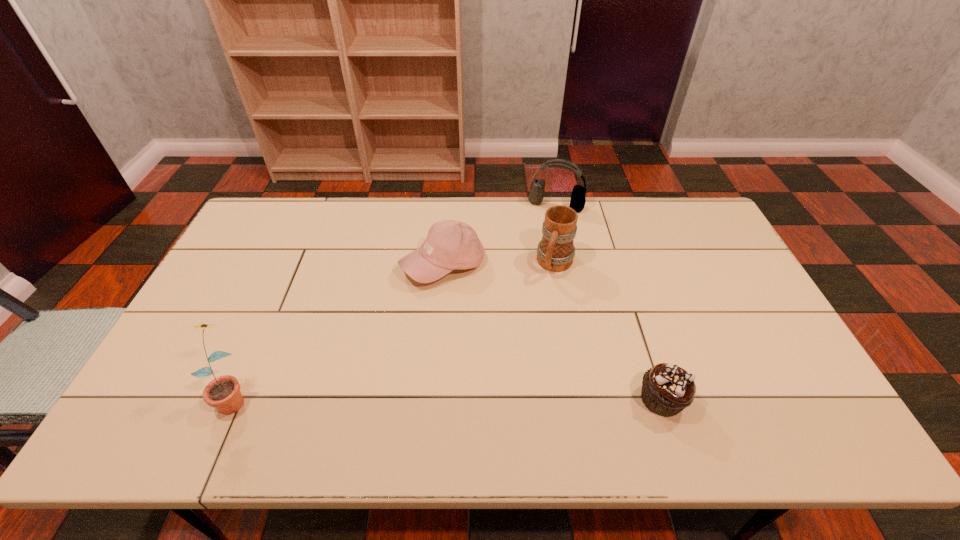
Find the location of a particular element. The image size is (960, 540). free region at the far edge of the desktop is located at coordinates (659, 225).

The image size is (960, 540). Identify the location of vacant region at the left edge. (268, 272).

In order to click on vacant space at the right edge of the desktop in this screenshot , I will do tap(747, 318).

You are a GUI agent. You are given a task and a screenshot of the screen. Output one action in this format:
    pyautogui.click(x=<x>, y=<y>)
    Task: Click on the vacant space at the far left corner
    The image size is (960, 540).
    Given the screenshot: What is the action you would take?
    [265, 222]

Find the location of a particular element. Image resolution: width=960 pixels, height=540 pixels. free point between the baseball cap and the sunflower is located at coordinates (339, 330).

Find the location of `free space between the mug and the fourth object from right to left`. free space between the mug and the fourth object from right to left is located at coordinates (499, 265).

Where is `free spot between the mug and the leftmost object`? This screenshot has width=960, height=540. free spot between the mug and the leftmost object is located at coordinates (395, 330).

The image size is (960, 540). What are the coordinates of `free spot between the sunflower and the mug` in the screenshot? It's located at (395, 330).

The image size is (960, 540). Find the location of `empty space between the mug and the baseball cap`. empty space between the mug and the baseball cap is located at coordinates (499, 265).

You are a GUI agent. You are given a task and a screenshot of the screen. Output one action in this format:
    pyautogui.click(x=<x>, y=<y>)
    Task: Click on the vacant space that is in between the tallest object and the mug
    This screenshot has width=960, height=540.
    Given the screenshot: What is the action you would take?
    pyautogui.click(x=395, y=330)